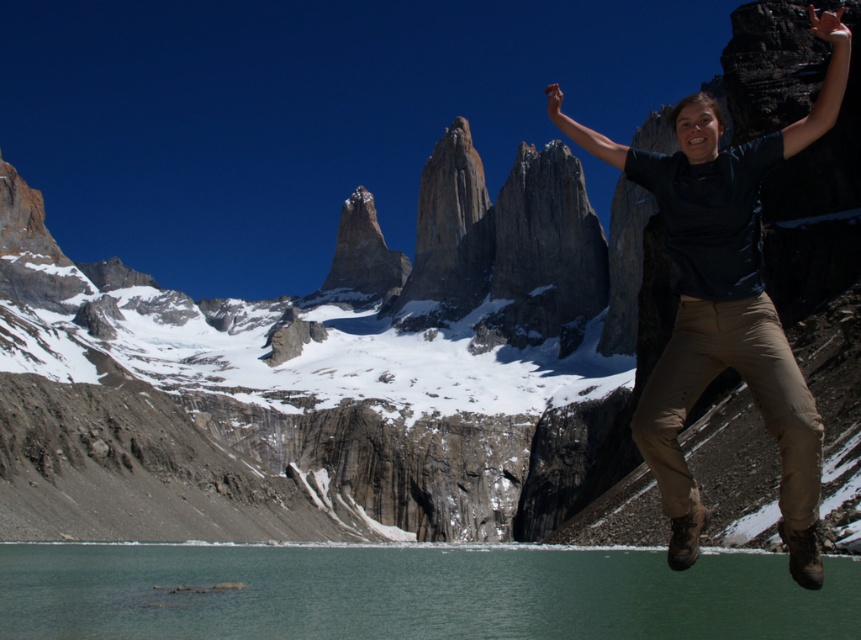
Question: Can you confirm if green water at lower center is thinner than dark blue t-shirt at center?

Choices:
 (A) yes
 (B) no

Answer: (B)

Question: Which object appears closest to the camera in this image?

Choices:
 (A) dark blue t-shirt at center
 (B) green water at lower center

Answer: (A)

Question: Which of the following is the closest to the observer?

Choices:
 (A) (73, 616)
 (B) (700, 284)

Answer: (B)

Question: Does green water at lower center have a lesser width compared to dark blue t-shirt at center?

Choices:
 (A) no
 (B) yes

Answer: (A)

Question: Is green water at lower center bigger than dark blue t-shirt at center?

Choices:
 (A) yes
 (B) no

Answer: (B)